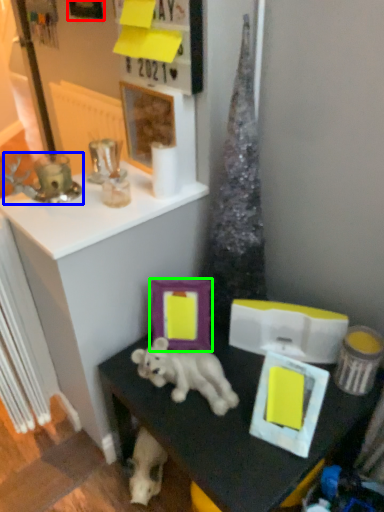
Question: Considering the real-world distances, which object is farthest from picture frame (highlighted by a red box)? candle holder (highlighted by a blue box) or picture frame (highlighted by a green box)?

Choices:
 (A) candle holder
 (B) picture frame

Answer: (B)